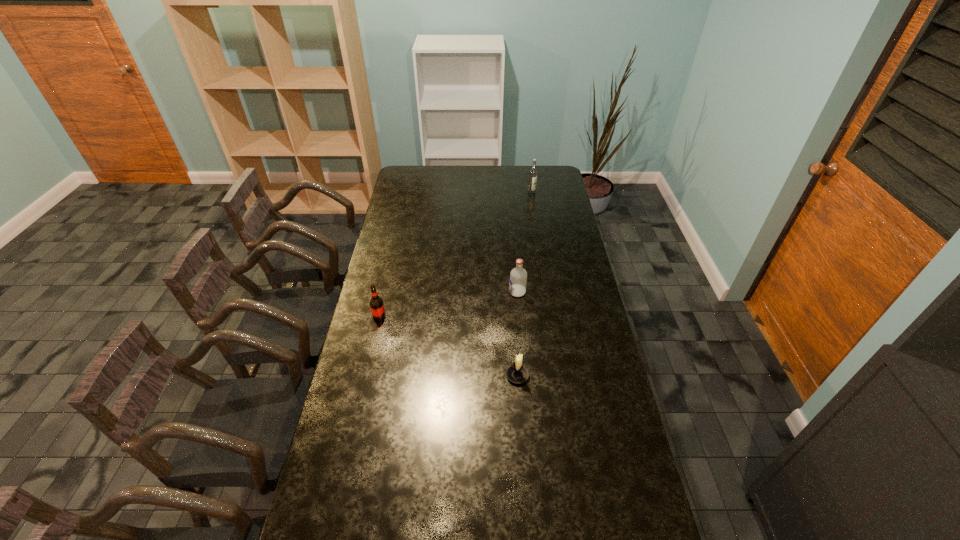
The height and width of the screenshot is (540, 960). I want to click on free space located on the label of the nearer vodka, so click(422, 292).

Locate an element on the screen. The height and width of the screenshot is (540, 960). vacant region located on the label of the nearer vodka is located at coordinates (468, 292).

You are a GUI agent. You are given a task and a screenshot of the screen. Output one action in this format:
    pyautogui.click(x=<x>, y=<y>)
    Task: Click on the vacant space located 0.250m on the right of the root beer
    The width and height of the screenshot is (960, 540).
    Given the screenshot: What is the action you would take?
    pyautogui.click(x=449, y=316)

Find the location of a particular element. free space located on the left of the shortest object is located at coordinates (402, 376).

Where is `object that is at the left edge`? The image size is (960, 540). object that is at the left edge is located at coordinates (376, 304).

Where is `object that is positioned at the right edge`? The width and height of the screenshot is (960, 540). object that is positioned at the right edge is located at coordinates (533, 172).

This screenshot has width=960, height=540. Identify the location of free space at the far edge of the desktop. (504, 167).

Image resolution: width=960 pixels, height=540 pixels. I want to click on free space at the left edge of the desktop, so click(374, 358).

In the image, there is a desktop. Where is `free region at the right edge`? The image size is (960, 540). free region at the right edge is located at coordinates (639, 497).

In the image, there is a desktop. Where is `vacant space at the far right corner`? The image size is (960, 540). vacant space at the far right corner is located at coordinates (546, 180).